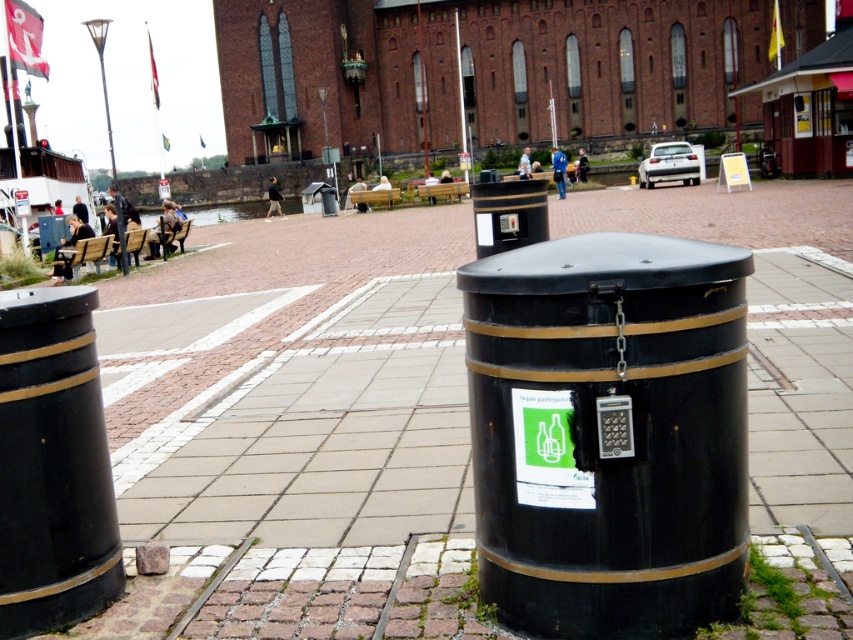
This screenshot has width=853, height=640. Describe the element at coordinates (51, 465) in the screenshot. I see `matte black barrel at left` at that location.

Is point (44, 400) in front of point (462, 99)?

Yes, it is.

Where is `matte black barrel at left`? This screenshot has width=853, height=640. matte black barrel at left is located at coordinates (51, 465).

Does matte black barrel at left have a greater width compared to smooth metal pole at center?

In fact, matte black barrel at left might be narrower than smooth metal pole at center.

Consider the image. Is matte black barrel at left positioned in front of smooth metal pole at center?

Yes, it is.

The image size is (853, 640). I want to click on matte black barrel at left, so click(x=51, y=465).

This screenshot has height=640, width=853. I want to click on matte black barrel at left, so click(51, 465).

Which is more to the left, matte black barrel at left or metallic streetlamp at upper left?

metallic streetlamp at upper left

Which is above, matte black barrel at left or metallic streetlamp at upper left?

Positioned higher is metallic streetlamp at upper left.

Where is `matte black barrel at left`? The image size is (853, 640). matte black barrel at left is located at coordinates (51, 465).

Locate an element on the screen. This screenshot has height=640, width=853. matte black barrel at left is located at coordinates (51, 465).